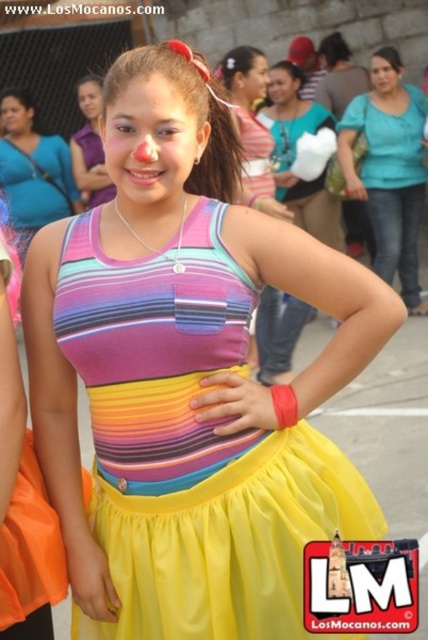
You are a photographer taking a portrait of the girl. You want to ensure the multicolored fabric dress at center and the smooth skin face at center are both in focus. Since the dress is to the left of the face, which object should you focus on first to ensure both are sharp?

The multicolored fabric dress at center is to the left of smooth skin face at center. To ensure both are in focus, you should focus on the multicolored fabric dress at center first, as it is closer to the camera, and then the smooth skin face at center will naturally fall into the depth of field.

You are a photographer adjusting your camera focus. You have two points in the image to focus on, point 1 at coordinates point [160,554] and point 2 at coordinates point [278,99]. Which point should you focus on first to ensure the subject is sharp?

Point 1 at coordinates point [160,554] should be focused on first because it is closer to the camera than point 2 at coordinates point [278,99].

You are a photographer trying to capture the girl in the image. You notice two faces in the scene, the matte skin face at center and the smooth skin face at center. Which face is closer to the camera?

The matte skin face at center is closer to the camera because it is in front of the smooth skin face at center.